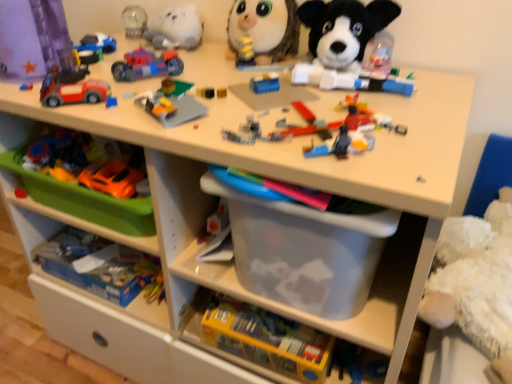
The width and height of the screenshot is (512, 384). I want to click on free space to the right of matte plastic car at upper left, positioned as the 5th toy in bottom-to-top order, so click(x=162, y=82).